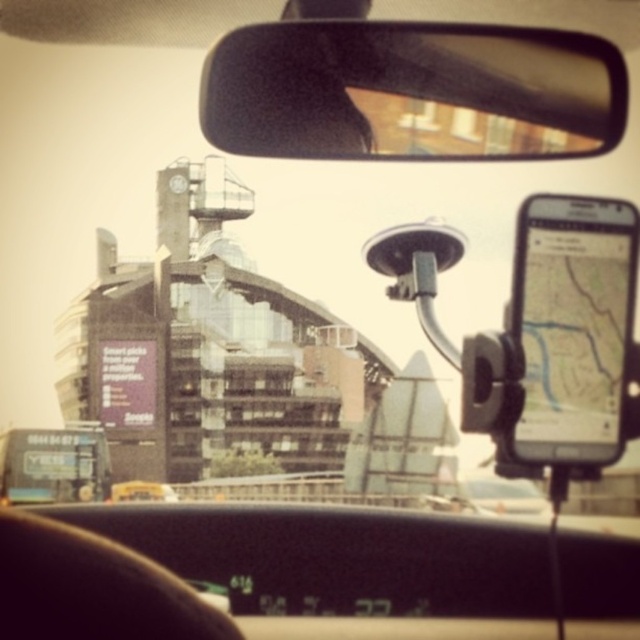
Question: Which object is farther from the camera taking this photo?

Choices:
 (A) black leather steering wheel at lower left
 (B) metallic billboard at lower left
 (C) clear plastic mirror at upper center

Answer: (B)

Question: Which point is farther to the camera?

Choices:
 (A) (420, 42)
 (B) (81, 451)

Answer: (B)

Question: Which of these objects is positioned farthest from the black leather steering wheel at lower left?

Choices:
 (A) clear plastic mirror at upper center
 (B) metallic billboard at lower left

Answer: (B)

Question: Can you confirm if clear plastic mirror at upper center is bigger than metallic billboard at lower left?

Choices:
 (A) yes
 (B) no

Answer: (A)

Question: Is clear plastic mirror at upper center above metallic billboard at lower left?

Choices:
 (A) yes
 (B) no

Answer: (A)

Question: Is clear plastic mirror at upper center positioned in front of black leather steering wheel at lower left?

Choices:
 (A) yes
 (B) no

Answer: (B)